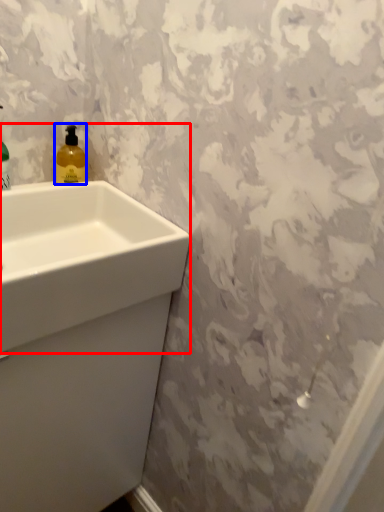
Question: Which object appears closest to the camera in this image, sink (highlighted by a red box) or soap dispenser (highlighted by a blue box)?

Choices:
 (A) sink
 (B) soap dispenser

Answer: (A)